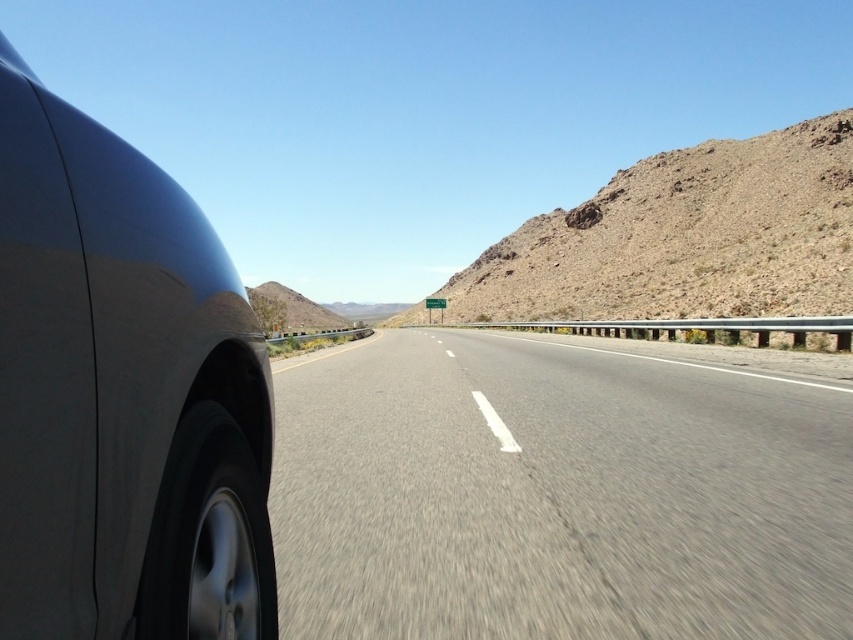
You are driving a car and want to know if you can safely open the passenger side door without hitting the satin metallic car at left. The standard door opening width is 3 feet. Can you open the door safely?

The satin metallic car at left is 3.62 feet away from viewer. Since the door opening width is 3 feet, there is enough space between the viewer and the satin metallic car at left to safely open the door.

Looking at this image, you are a passenger in the vehicle and notice the satin metallic car at left and the brown rocky mountain at upper right through the window. Which object appears closer to you based on their sizes?

The satin metallic car at left appears closer because it has a lesser height compared to the brown rocky mountain at upper right, which is farther away.